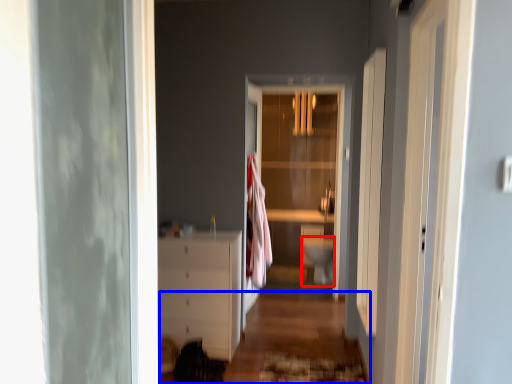
Question: Which point is closer to the camera, toilet bowl (highlighted by a red box) or path (highlighted by a blue box)?

Choices:
 (A) toilet bowl
 (B) path

Answer: (B)